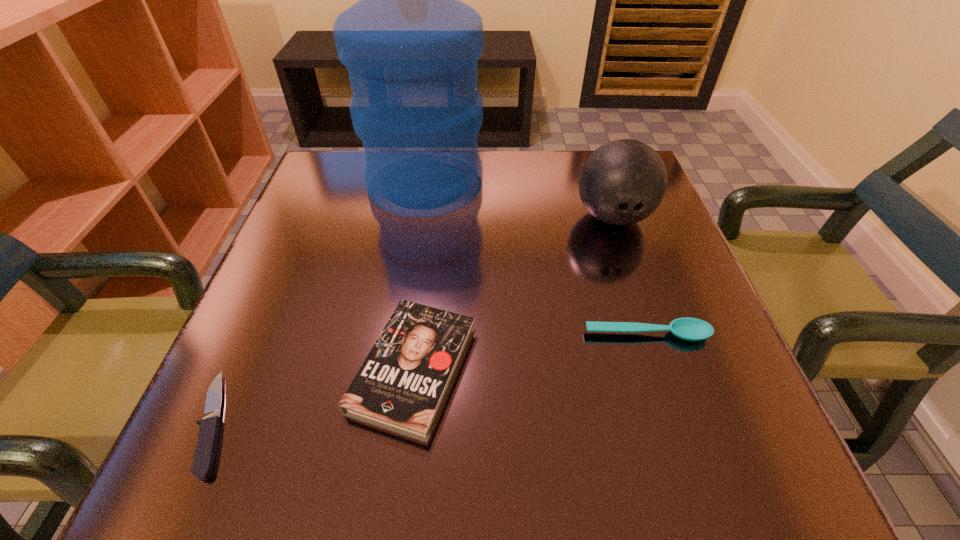
This screenshot has height=540, width=960. I want to click on free space between the book and the shortest object, so click(x=314, y=396).

Locate an element on the screen. blank region between the book and the second tallest object is located at coordinates (514, 293).

Where is `unoccupied area between the shortest object and the tallest object`? This screenshot has width=960, height=540. unoccupied area between the shortest object and the tallest object is located at coordinates (320, 303).

You are a GUI agent. You are given a task and a screenshot of the screen. Output one action in this format:
    pyautogui.click(x=<x>, y=<y>)
    Task: Click on the free space that is in between the shortest object and the third shortest object
    
    Given the screenshot: What is the action you would take?
    pyautogui.click(x=314, y=396)

In order to click on vacant space that's between the second tallest object and the book in this screenshot , I will do `click(514, 293)`.

Where is `the fourth closest object to the tallest object`? The image size is (960, 540). the fourth closest object to the tallest object is located at coordinates (207, 443).

Identify which object is the third closest to the tallest object. Please provide its 2D coordinates. Your answer should be formatted as a tuple, i.e. [(x, y)], where the tuple contains the x and y coordinates of a point satisfying the conditions above.

[(692, 329)]

The width and height of the screenshot is (960, 540). Identify the location of vacant space that satisfies the following two spatial constraints: 1. on the back side of the book; 2. on the left side of the leftmost object. (238, 369).

Find the location of a particular element. This screenshot has width=960, height=540. free space that satisfies the following two spatial constraints: 1. on the back side of the shortest object; 2. on the left side of the water jug is located at coordinates (320, 184).